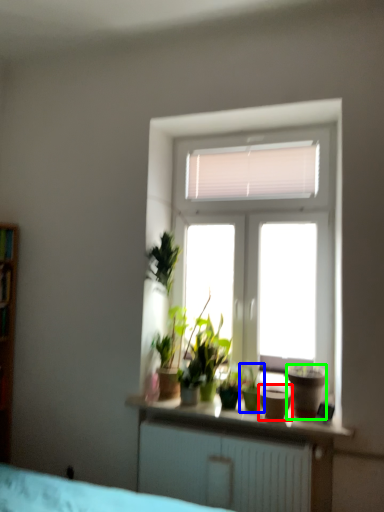
Question: Which is nearer to the flowerpot (highlighted by a red box)? houseplant (highlighted by a blue box) or flowerpot (highlighted by a green box).

Choices:
 (A) houseplant
 (B) flowerpot

Answer: (A)